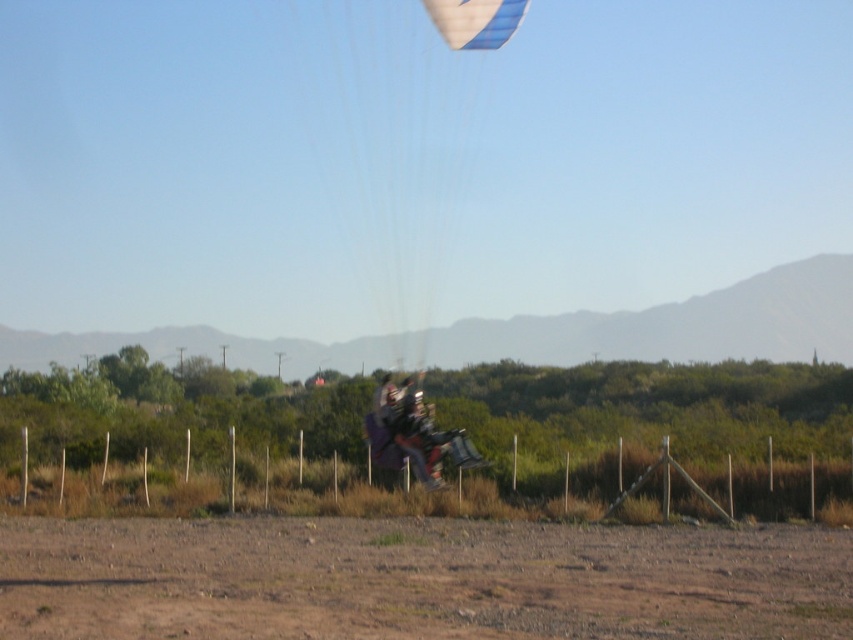
In the scene shown: Is dull brown dirt at lower center to the right of blue striped fabric parachute at center from the viewer's perspective?

Correct, you'll find dull brown dirt at lower center to the right of blue striped fabric parachute at center.

Who is more forward, (x=601, y=634) or (x=347, y=100)?

Point (x=601, y=634)

Find the location of a particular element. dull brown dirt at lower center is located at coordinates (418, 580).

Where is `dull brown dirt at lower center`? dull brown dirt at lower center is located at coordinates (418, 580).

Does dark purple fabric parachute at center appear on the right side of blue glossy parachute at upper center?

No, dark purple fabric parachute at center is not to the right of blue glossy parachute at upper center.

Is dark purple fabric parachute at center above blue glossy parachute at upper center?

Incorrect, dark purple fabric parachute at center is not positioned above blue glossy parachute at upper center.

Is point (416, 467) farther from viewer compared to point (467, 13)?

That is False.

This screenshot has height=640, width=853. Identify the location of dark purple fabric parachute at center. (405, 429).

Is dull brown dirt at lower center shorter than dark purple fabric parachute at center?

Yes, dull brown dirt at lower center is shorter than dark purple fabric parachute at center.

What do you see at coordinates (418, 580) in the screenshot? The image size is (853, 640). I see `dull brown dirt at lower center` at bounding box center [418, 580].

This screenshot has width=853, height=640. I want to click on dull brown dirt at lower center, so click(x=418, y=580).